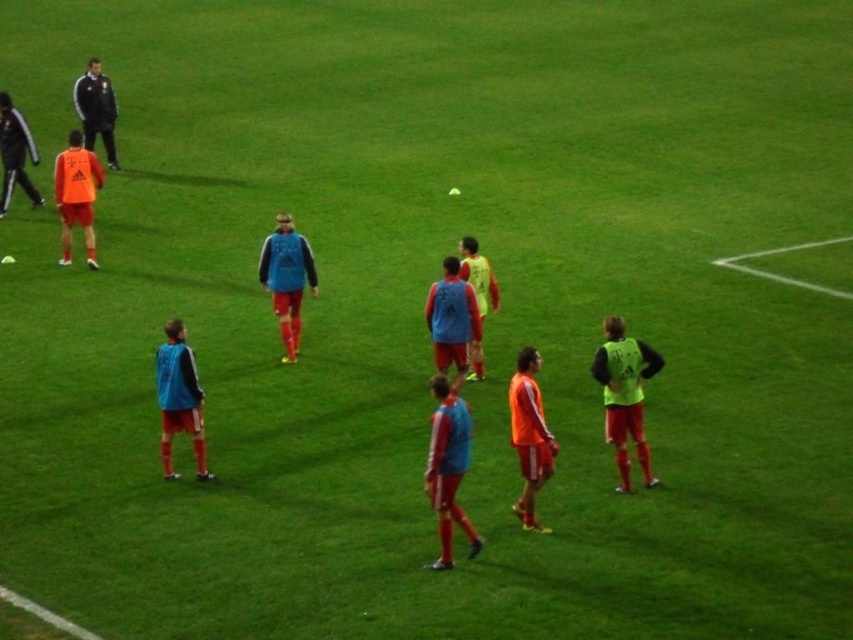
Question: Is blue fleece jacket at center bigger than orange jersey at left?

Choices:
 (A) no
 (B) yes

Answer: (A)

Question: Estimate the real-world distances between objects in this image. Which object is farther from the dark gray smooth jacket at upper left?

Choices:
 (A) orange jersey at left
 (B) matte black jacket at left

Answer: (A)

Question: Is orange jersey at left above dark gray smooth jacket at upper left?

Choices:
 (A) yes
 (B) no

Answer: (B)

Question: Which of the following is the closest to the observer?

Choices:
 (A) matte black jacket at left
 (B) orange jersey at left

Answer: (B)

Question: Which object is closer to the camera taking this photo?

Choices:
 (A) blue fleece jacket at center
 (B) matte black jacket at left
 (C) orange jersey at left
 (D) dark gray smooth jacket at upper left

Answer: (A)

Question: Is blue fleece jacket at center to the right of matte black jacket at left from the viewer's perspective?

Choices:
 (A) yes
 (B) no

Answer: (A)